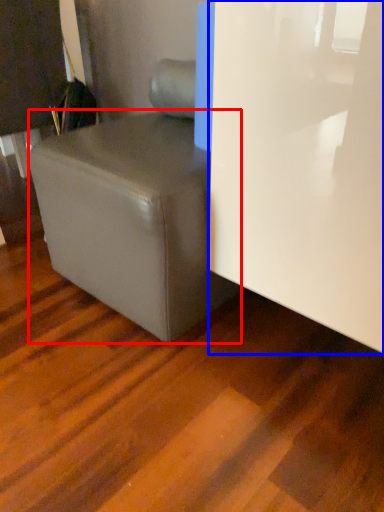
Question: Which object appears closest to the camera in this image, table (highlighted by a red box) or glass door (highlighted by a blue box)?

Choices:
 (A) table
 (B) glass door

Answer: (B)